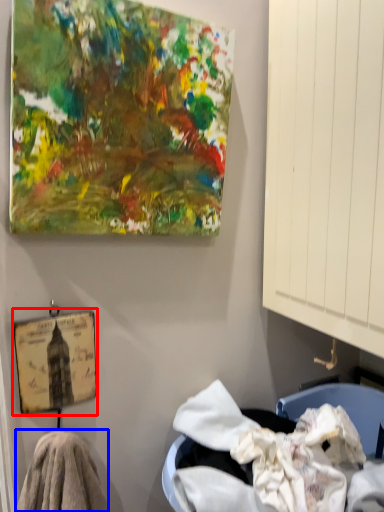
Question: Which point is closer to the camera, picture frame (highlighted by a red box) or material (highlighted by a blue box)?

Choices:
 (A) picture frame
 (B) material

Answer: (B)